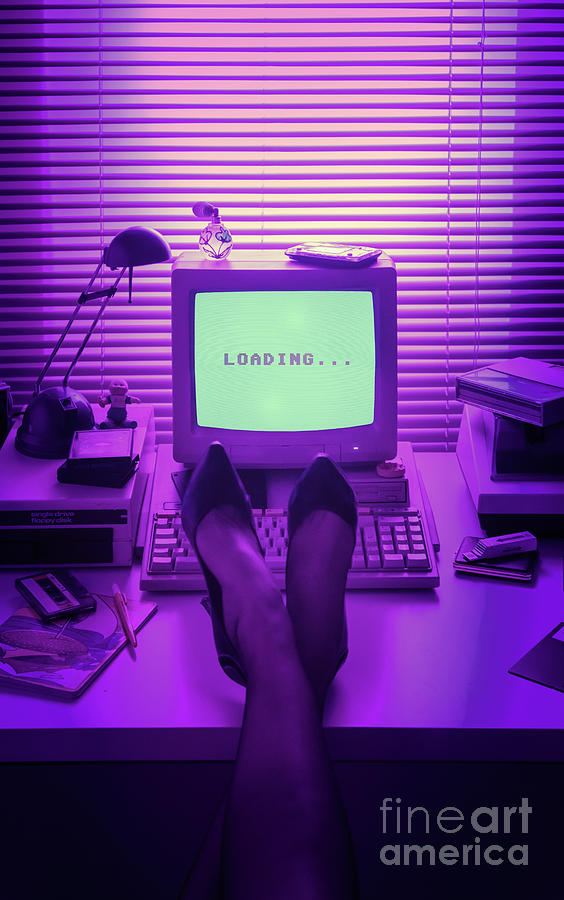
Locate an element on the screen. This screenshot has width=564, height=900. lamp shade is located at coordinates [x=132, y=248].